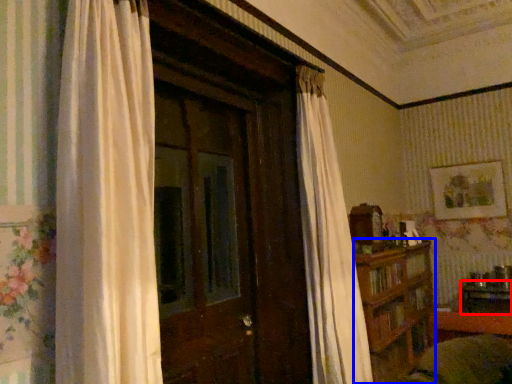
Question: Which point is closer to the camera, table (highlighted by a red box) or furniture (highlighted by a blue box)?

Choices:
 (A) table
 (B) furniture

Answer: (B)